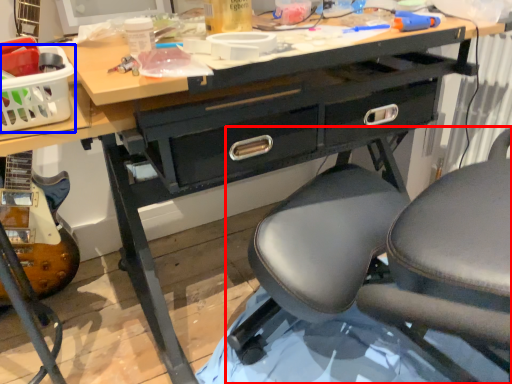
Question: Among these objects, which one is nearest to the camera, chair (highlighted by a red box) or basket (highlighted by a blue box)?

Choices:
 (A) chair
 (B) basket

Answer: (A)